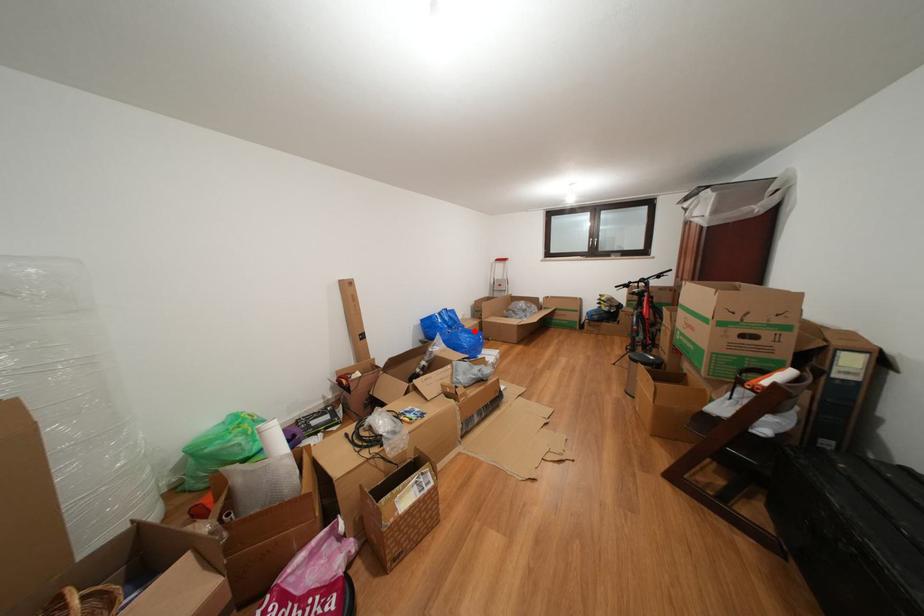
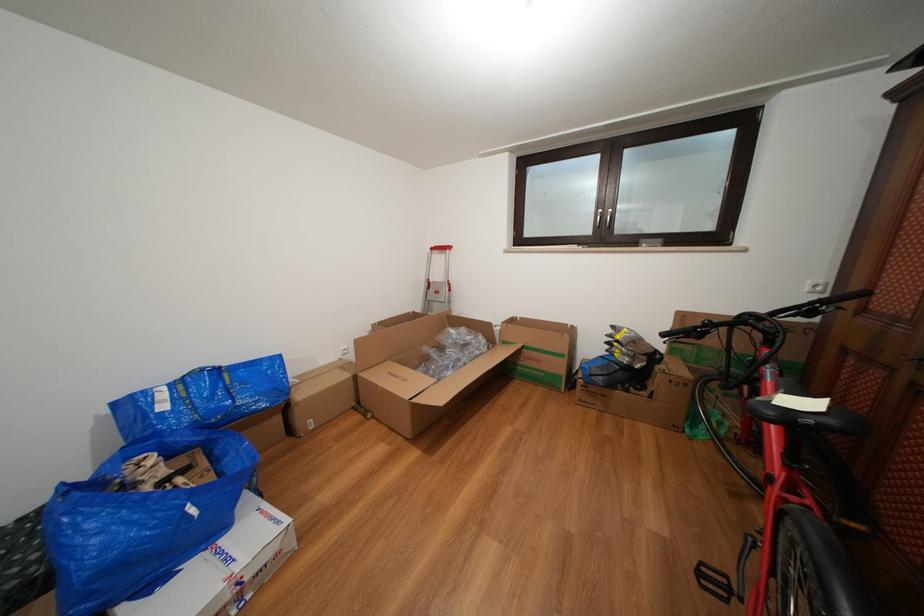
Question: A red point is marked in image1. In image2, is the corresponding 3D point closer to the camera or farther? Reply with the corresponding letter.

Choices:
 (A) The corresponding 3D point is closer.
 (B) The corresponding 3D point is farther.

Answer: (A)